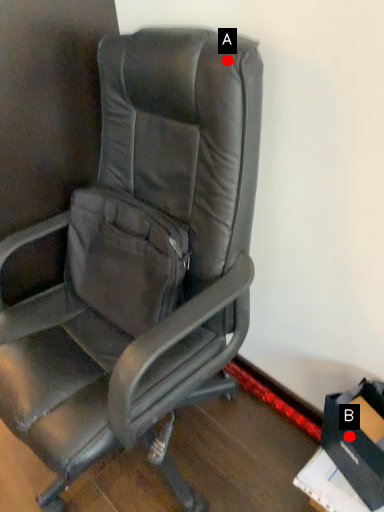
Question: Two points are circled on the image, labeled by A and B beside each circle. Which point appears closest to the camera in this image?

Choices:
 (A) A is closer
 (B) B is closer

Answer: (A)